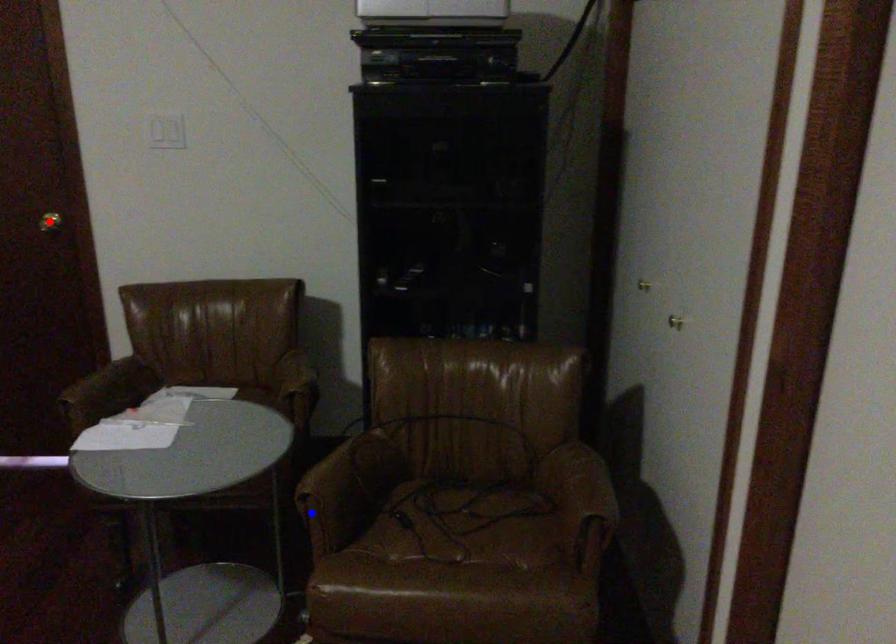
Question: Which of the two points in the image is closer to the camera?

Choices:
 (A) Blue point is closer.
 (B) Red point is closer.

Answer: (A)